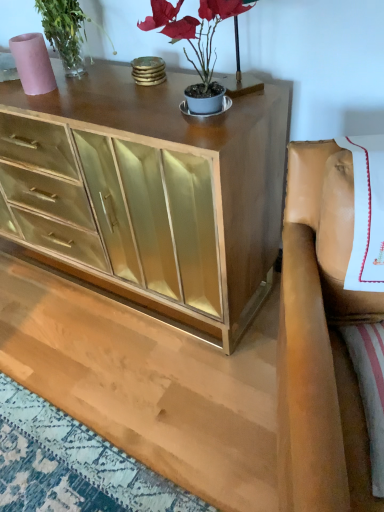
The height and width of the screenshot is (512, 384). I want to click on free location in front of gold mirrored cabinet at center, so click(120, 366).